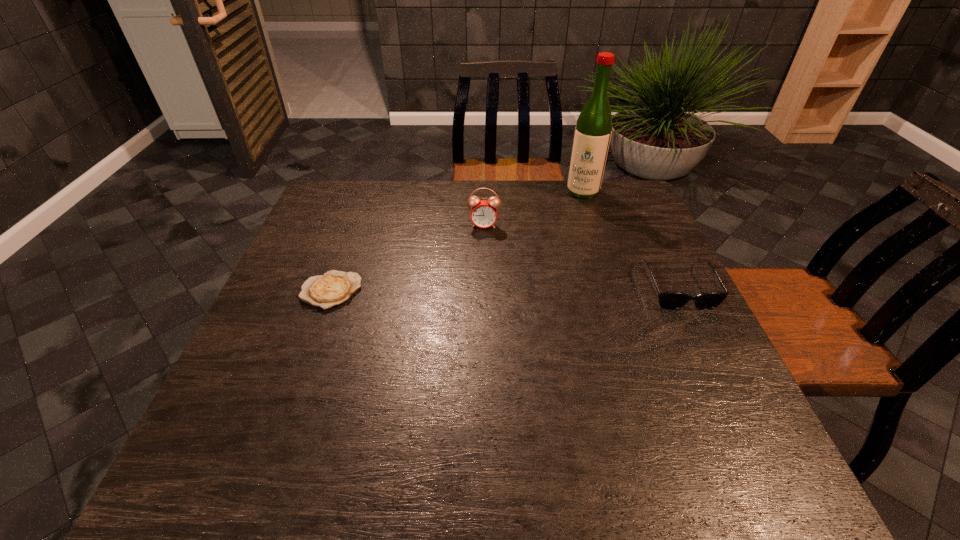
Where is `free space between the shortest object and the farthest object`? This screenshot has width=960, height=540. free space between the shortest object and the farthest object is located at coordinates (457, 241).

The width and height of the screenshot is (960, 540). I want to click on empty space between the rightmost object and the quiche, so click(x=504, y=288).

Locate an element on the screen. This screenshot has width=960, height=540. vacant point located between the leftmost object and the liquor is located at coordinates (457, 241).

Locate an element on the screen. vacant space that's between the third tallest object and the quiche is located at coordinates (504, 288).

Identify the location of free spot between the tallest object and the rightmost object. (630, 239).

What are the coordinates of `empty space between the third object from left to right and the sunglasses` in the screenshot? It's located at (630, 239).

The width and height of the screenshot is (960, 540). Identify the location of free spot between the third object from right to left and the sunglasses. (580, 255).

The height and width of the screenshot is (540, 960). What are the coordinates of `empty location between the third shortest object and the farthest object` in the screenshot? It's located at (534, 208).

Find the location of a particular element. This screenshot has width=960, height=540. free space between the shortest object and the third tallest object is located at coordinates (504, 288).

Where is `the third closest object to the third object from right to left`? The height and width of the screenshot is (540, 960). the third closest object to the third object from right to left is located at coordinates (667, 300).